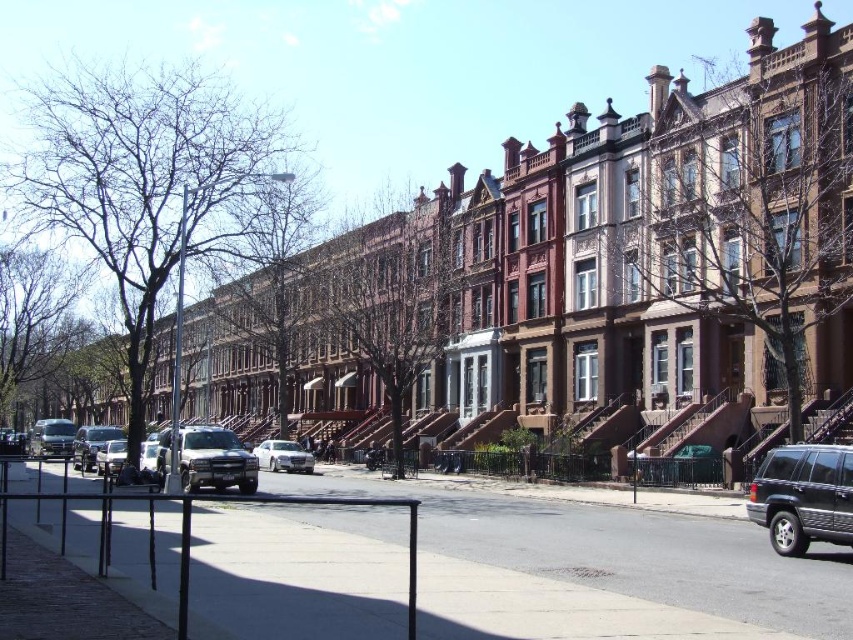
Question: Does black matte suv at lower right appear on the right side of matte silver sedan at center-left?

Choices:
 (A) yes
 (B) no

Answer: (A)

Question: Does black matte suv at lower right appear over matte black suv at center?

Choices:
 (A) yes
 (B) no

Answer: (A)

Question: Which point appears closest to the camera in this image?

Choices:
 (A) (817, 518)
 (B) (108, 444)
 (C) (38, 428)

Answer: (A)

Question: Which point is farther to the camera?

Choices:
 (A) pyautogui.click(x=775, y=506)
 (B) pyautogui.click(x=277, y=445)

Answer: (B)

Question: Which of the following is the closest to the observer?

Choices:
 (A) (784, 445)
 (B) (67, 428)
 (C) (270, 468)

Answer: (A)

Question: Is matte silver suv at center to the left of shiny silver sedan at center-left from the viewer's perspective?

Choices:
 (A) no
 (B) yes

Answer: (A)